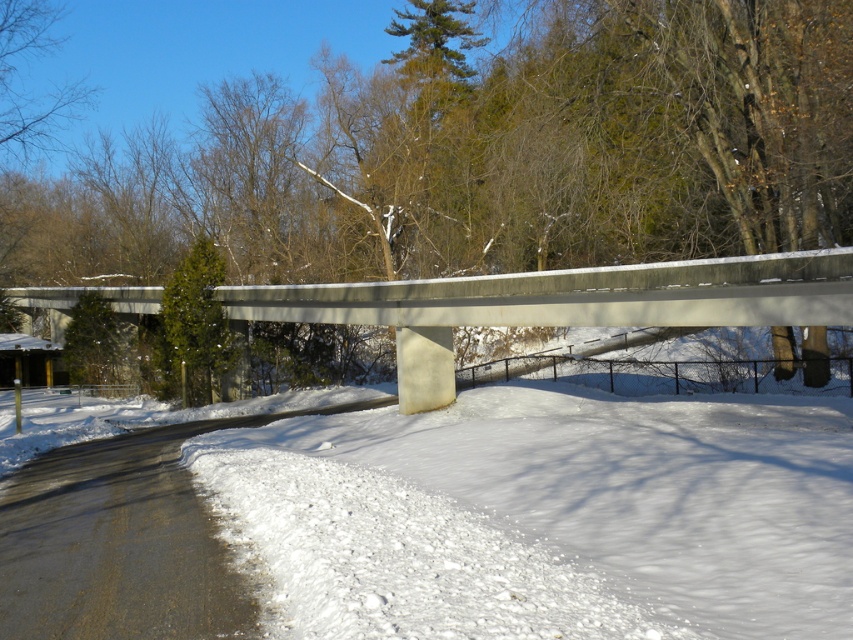
Does white powdery snow at lower center appear under concrete at upper center?

Yes, white powdery snow at lower center is below concrete at upper center.

This screenshot has width=853, height=640. Identify the location of white powdery snow at lower center. (547, 515).